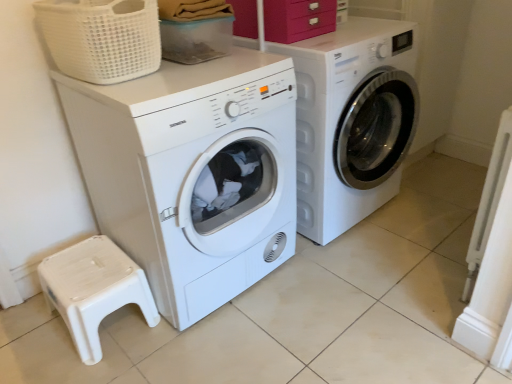
The width and height of the screenshot is (512, 384). I want to click on free space in front of white glossy washing machine at center, the first washing machine positioned from the right, so click(356, 290).